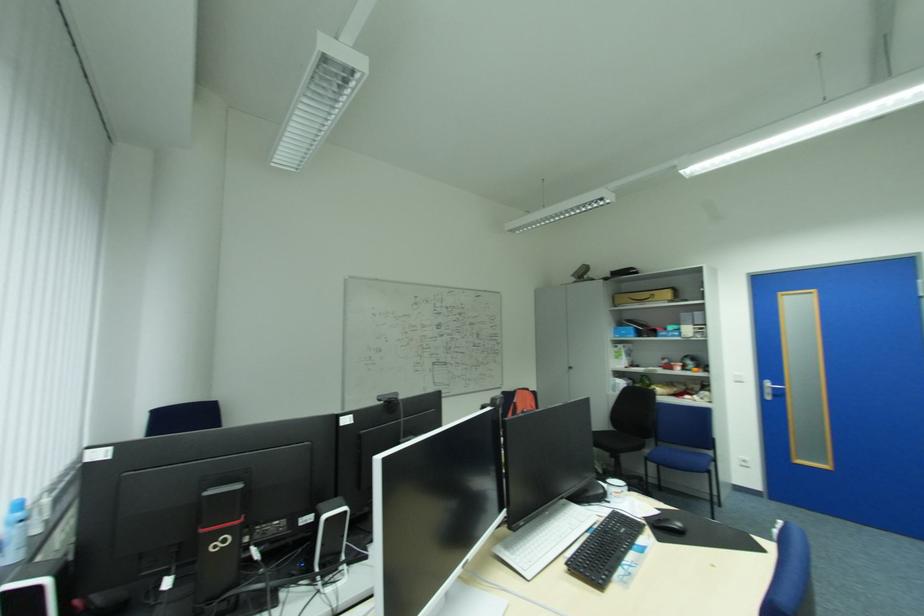
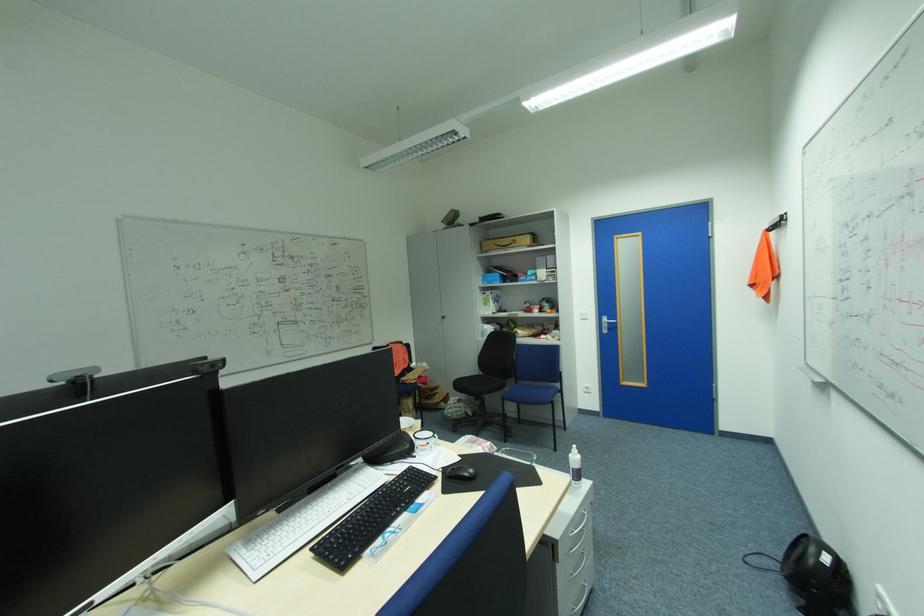
Question: How did the camera likely rotate?

Choices:
 (A) Left
 (B) Right
 (C) Up
 (D) Down

Answer: (B)